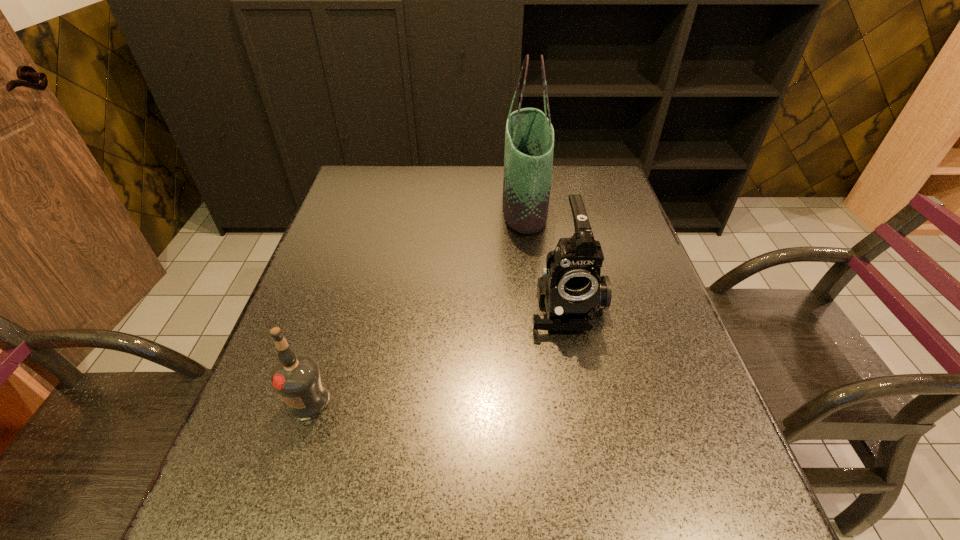
You are a GUI agent. You are given a task and a screenshot of the screen. Output one action in this format:
    pyautogui.click(x=<x>, y=<y>)
    Task: Click on the free space that is in between the camcorder and the leftmost object
    
    Given the screenshot: What is the action you would take?
    pyautogui.click(x=437, y=352)

Locate an element on the screen. The image size is (960, 540). free space that is in between the nearest object and the tote bag is located at coordinates (416, 303).

I want to click on empty space between the tallest object and the nearest object, so click(416, 303).

Find the location of a particular element. free area in between the second nearest object and the tallest object is located at coordinates (545, 255).

The width and height of the screenshot is (960, 540). In order to click on vacant point located between the camcorder and the vodka in this screenshot , I will do `click(437, 352)`.

Find the location of a particular element. Image resolution: width=960 pixels, height=540 pixels. vacant point located between the tote bag and the second nearest object is located at coordinates (545, 255).

The height and width of the screenshot is (540, 960). Find the location of `object that can be found as the second closest to the camcorder`. object that can be found as the second closest to the camcorder is located at coordinates (296, 378).

Select which object appears as the closest to the vodka. Please provide its 2D coordinates. Your answer should be formatted as a tuple, i.e. [(x, y)], where the tuple contains the x and y coordinates of a point satisfying the conditions above.

[(571, 288)]